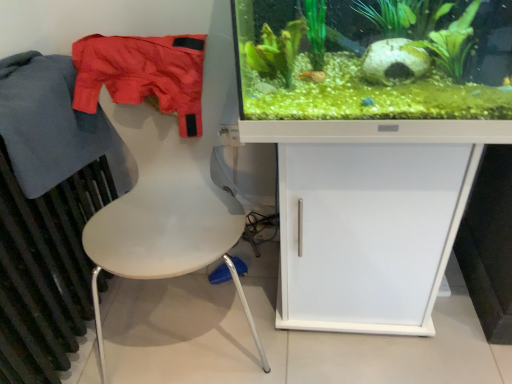
Question: Is blue cotton jacket at left, the 1th clothing positioned from the left, outside white matte chair at left?

Choices:
 (A) yes
 (B) no

Answer: (A)

Question: Is white matte chair at left surrounded by blue cotton jacket at left, which appears as the 2th clothing when viewed from the right?

Choices:
 (A) no
 (B) yes

Answer: (A)

Question: Does blue cotton jacket at left, the 1th clothing positioned from the left, appear on the right side of white matte chair at left?

Choices:
 (A) no
 (B) yes

Answer: (A)

Question: Is blue cotton jacket at left, which appears as the 2th clothing when viewed from the right, placed right next to white matte chair at left?

Choices:
 (A) no
 (B) yes

Answer: (A)

Question: Are blue cotton jacket at left, which appears as the 2th clothing when viewed from the right, and white matte chair at left located far from each other?

Choices:
 (A) yes
 (B) no

Answer: (B)

Question: Considering the positions of point (423, 145) and point (33, 69), is point (423, 145) closer or farther from the camera than point (33, 69)?

Choices:
 (A) farther
 (B) closer

Answer: (B)

Question: Which is correct: white matte cabinet at center is inside blue cotton jacket at left, the 1th clothing positioned from the left, or outside of it?

Choices:
 (A) inside
 (B) outside

Answer: (B)

Question: Would you say white matte cabinet at center is to the left or to the right of blue cotton jacket at left, the 1th clothing positioned from the left, in the picture?

Choices:
 (A) right
 (B) left

Answer: (A)

Question: In terms of height, does white matte cabinet at center look taller or shorter compared to blue cotton jacket at left, which appears as the 2th clothing when viewed from the right?

Choices:
 (A) short
 (B) tall

Answer: (B)

Question: Considering the relative positions of green matte plant at upper center and white matte cabinet at center in the image provided, is green matte plant at upper center to the left or to the right of white matte cabinet at center?

Choices:
 (A) right
 (B) left

Answer: (B)

Question: Considering their positions, is green matte plant at upper center located in front of or behind white matte cabinet at center?

Choices:
 (A) front
 (B) behind

Answer: (A)

Question: Is green matte plant at upper center inside the boundaries of white matte cabinet at center, or outside?

Choices:
 (A) inside
 (B) outside

Answer: (B)

Question: From a real-world perspective, relative to white matte cabinet at center, is green matte plant at upper center vertically above or below?

Choices:
 (A) above
 (B) below

Answer: (A)

Question: From a real-world perspective, relative to green matte plant at upper center, is white matte cabinet at center vertically above or below?

Choices:
 (A) below
 (B) above

Answer: (A)

Question: Considering the positions of point (241, 127) and point (296, 54), is point (241, 127) closer or farther from the camera than point (296, 54)?

Choices:
 (A) closer
 (B) farther

Answer: (A)